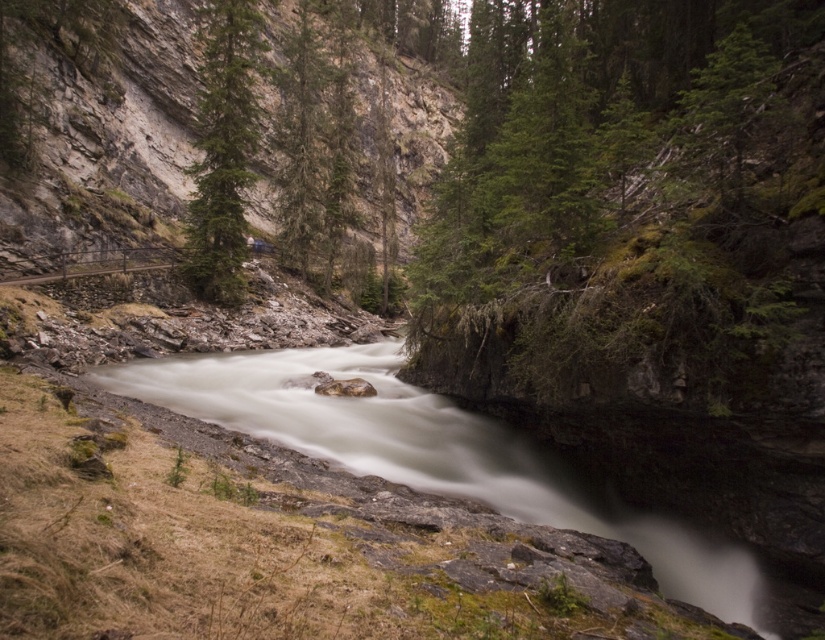
Question: Is green matte tree at upper center closer to the viewer compared to green textured tree at center?

Choices:
 (A) no
 (B) yes

Answer: (B)

Question: Can you confirm if green matte tree at upper center is positioned below green textured tree at center?

Choices:
 (A) no
 (B) yes

Answer: (B)

Question: Is green matte tree at upper center below green textured tree at center?

Choices:
 (A) yes
 (B) no

Answer: (A)

Question: Among these points, which one is farthest from the camera?

Choices:
 (A) (194, 225)
 (B) (312, 147)

Answer: (B)